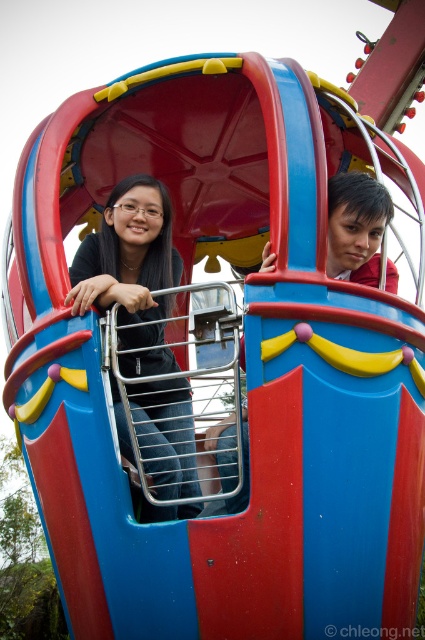
You are standing in front of the amusement ride and want to locate the point at coordinates point [130,252]. Which object is this point located on?

The point [130,252] is located on the matte black shirt at left.

You are designing a new carnival ride and need to ensure safety harnesses fit both riders. Given the sizes of the matte black shirt at left and the smooth red shirt at upper right, which rider requires a larger harness?

The matte black shirt at left requires a larger harness because it is bigger than the smooth red shirt at upper right.